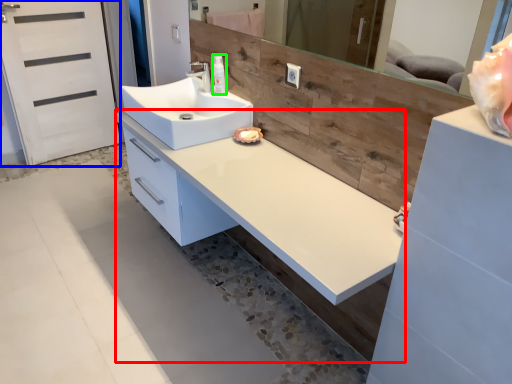
Question: Considering the real-world distances, which object is farthest from counter (highlighted by a red box)? screen door (highlighted by a blue box) or toiletry (highlighted by a green box)?

Choices:
 (A) screen door
 (B) toiletry

Answer: (A)